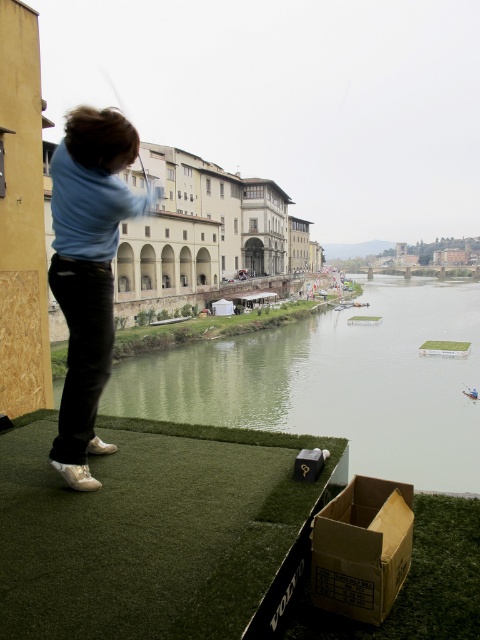
Between green smooth water at center and brown cardboard box at lower right, which one has more height?

→ green smooth water at center

Does green smooth water at center come in front of brown cardboard box at lower right?

No, it is not.

Image resolution: width=480 pixels, height=640 pixels. What do you see at coordinates (336, 381) in the screenshot? I see `green smooth water at center` at bounding box center [336, 381].

Find the location of a particular element. The height and width of the screenshot is (640, 480). green smooth water at center is located at coordinates (336, 381).

In the scene shown: Who is more forward, (84, 419) or (105, 74)?

Positioned in front is point (84, 419).

Is matte blue sweater at center bigger than metallic silver golf club at upper left?

No, matte blue sweater at center is not bigger than metallic silver golf club at upper left.

This screenshot has width=480, height=640. What do you see at coordinates (87, 272) in the screenshot?
I see `matte blue sweater at center` at bounding box center [87, 272].

I want to click on matte blue sweater at center, so click(87, 272).

Is point (342, 564) positioned behind point (121, 108)?

No, (342, 564) is in front of (121, 108).

Between point (355, 612) and point (144, 184), which one is positioned in front?

Point (355, 612) is more forward.

The width and height of the screenshot is (480, 640). Identify the location of brown cardboard box at lower right. (361, 548).